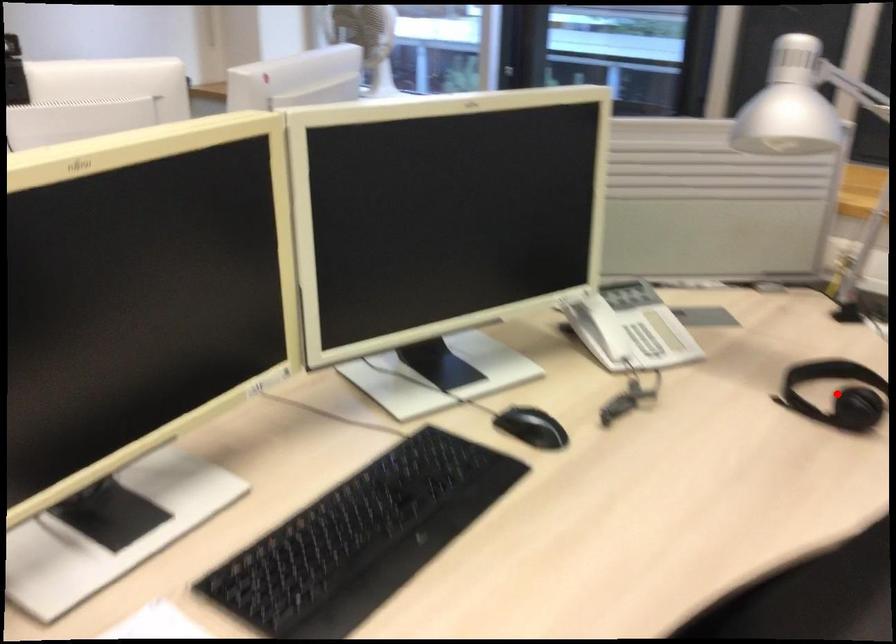
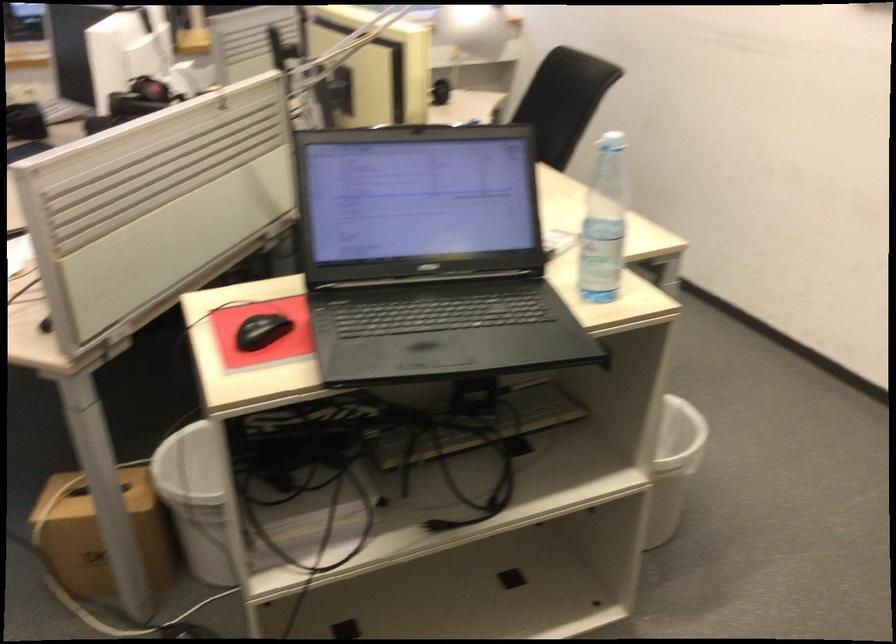
Question: I am providing you with two images of the same scene from different viewpoints. A red point is marked on the first image. Is the red point's position out of view in image 2?

Choices:
 (A) Yes
 (B) No

Answer: (A)